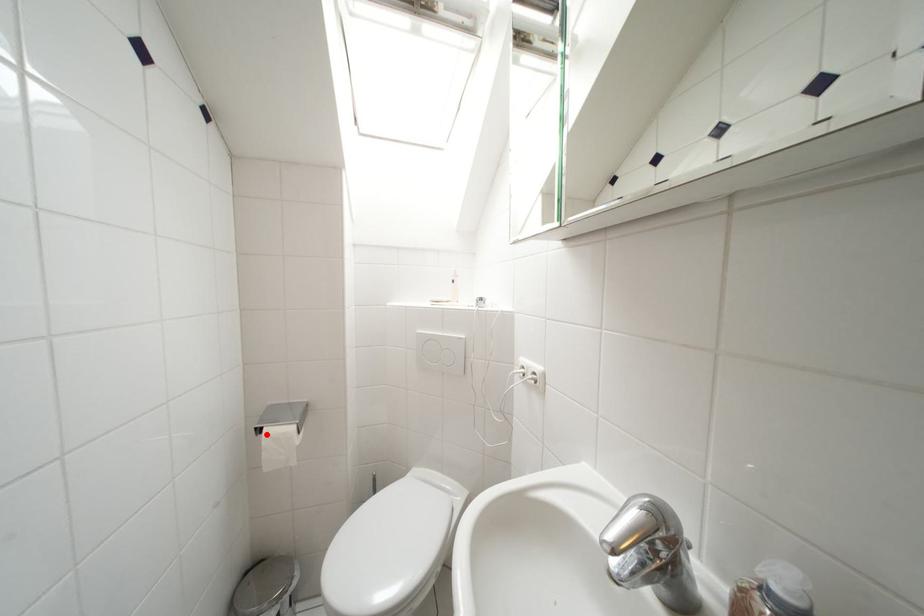
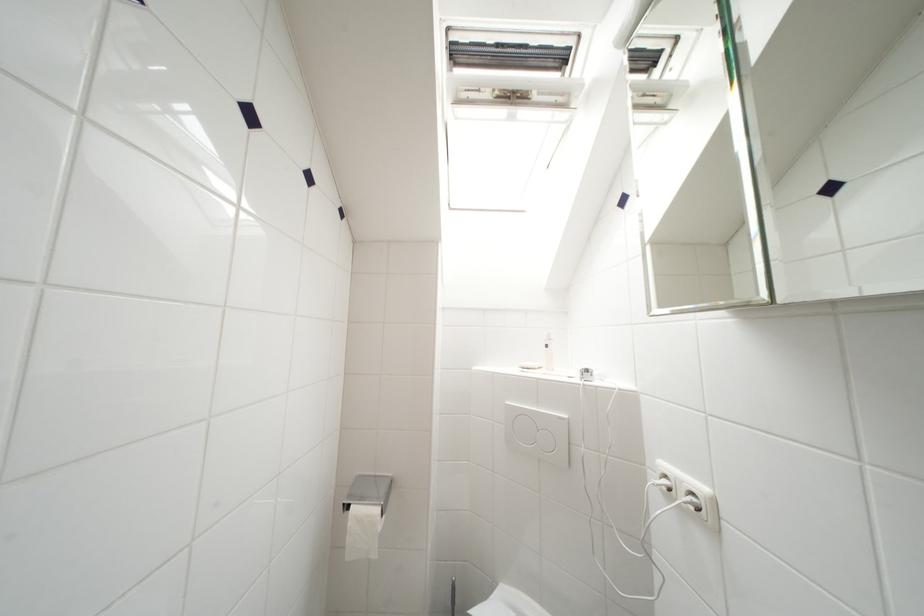
The point at the highlighted location is marked in the first image. Where is the corresponding point in the second image?

(354, 512)